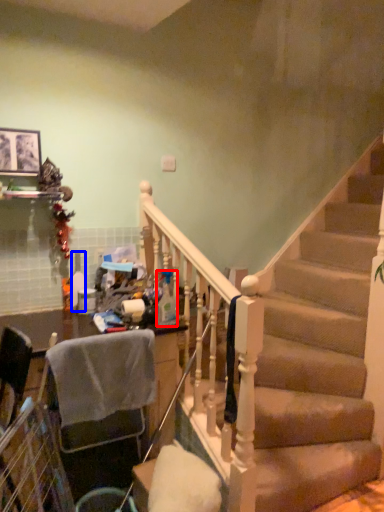
Question: Which of the following is the closest to the observer, bottle (highlighted by a red box) or bottle (highlighted by a blue box)?

Choices:
 (A) bottle
 (B) bottle

Answer: (A)